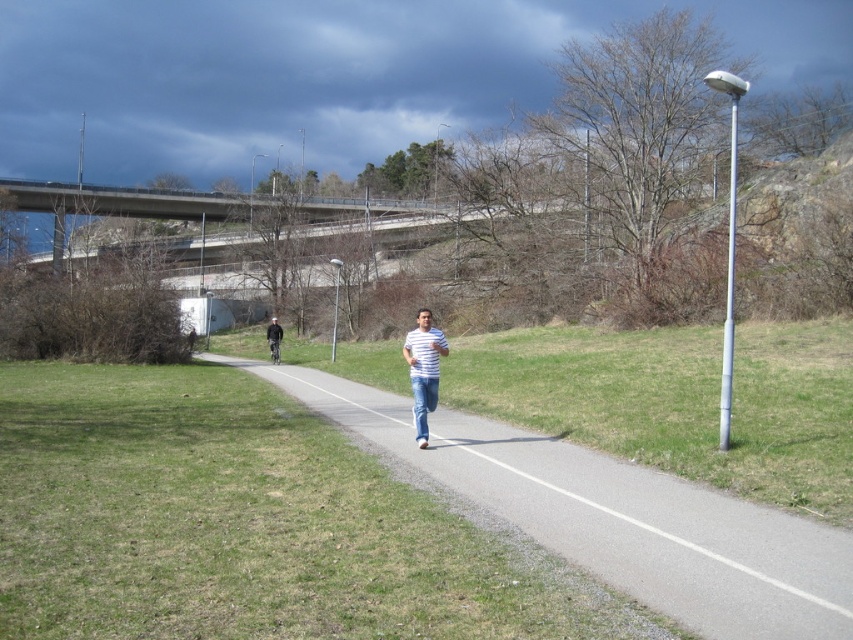
Can you confirm if concrete bridge at upper center is positioned to the left of striped fabric shirt at center?

Correct, you'll find concrete bridge at upper center to the left of striped fabric shirt at center.

Is point (73, 196) positioned behind point (432, 364)?

Yes, it is behind point (432, 364).

Where is `concrete bridge at upper center`? concrete bridge at upper center is located at coordinates (183, 202).

Locate an element on the screen. This screenshot has width=853, height=640. concrete bridge at upper center is located at coordinates (183, 202).

Does gray asphalt path at center have a smaller size compared to striped fabric shirt at center?

No.

Where is `gray asphalt path at center`? This screenshot has height=640, width=853. gray asphalt path at center is located at coordinates (612, 515).

From the picture: Which is more to the left, concrete bridge at upper center or dark blue jeans at center?

concrete bridge at upper center

Can you confirm if concrete bridge at upper center is wider than dark blue jeans at center?

Yes.

Image resolution: width=853 pixels, height=640 pixels. I want to click on concrete bridge at upper center, so click(x=183, y=202).